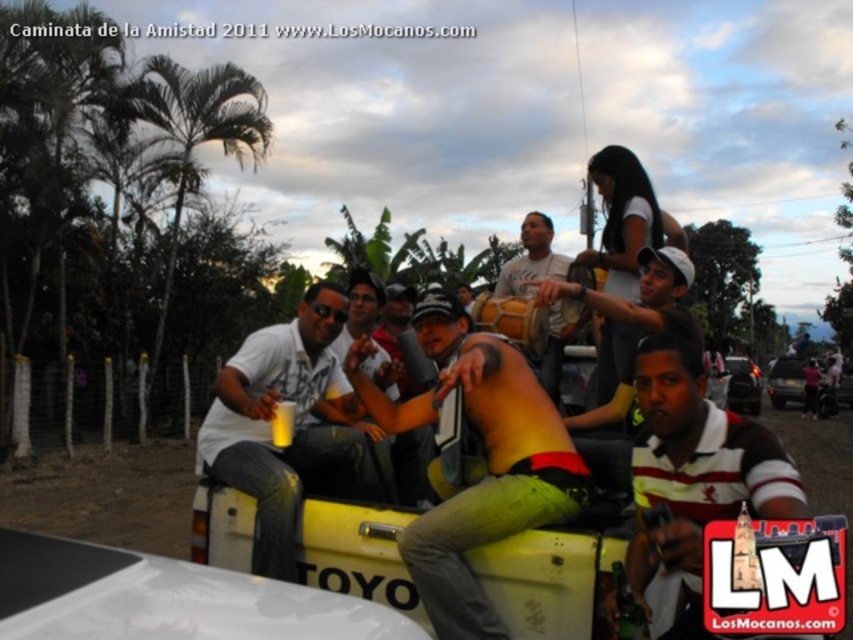
Which is below, brown leather jacket at center or black matte car at center?

black matte car at center

The image size is (853, 640). What do you see at coordinates (639, 294) in the screenshot?
I see `brown leather jacket at center` at bounding box center [639, 294].

Who is more distant from viewer, (641, 282) or (737, 397)?

The point (737, 397) is behind.

Locate an element on the screen. brown leather jacket at center is located at coordinates (639, 294).

Is white matte shirt at center to the right of green leafy palm tree at upper left from the viewer's perspective?

Correct, you'll find white matte shirt at center to the right of green leafy palm tree at upper left.

Does white matte shirt at center lie in front of green leafy palm tree at upper left?

Yes, white matte shirt at center is closer to the viewer.

Locate an element on the screen. white matte shirt at center is located at coordinates (293, 428).

Who is taller, green leafy palm tree at upper left or matte yellow drum at center?

matte yellow drum at center is taller.

Locate an element on the screen. The image size is (853, 640). green leafy palm tree at upper left is located at coordinates (192, 134).

Locate an element on the screen. green leafy palm tree at upper left is located at coordinates (192, 134).